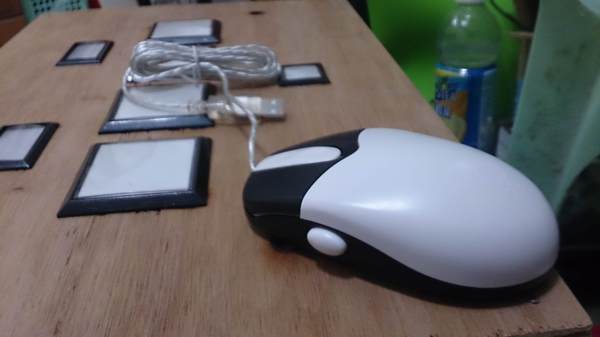
In order to click on black and white computer mouse in this screenshot , I will do `click(367, 208)`.